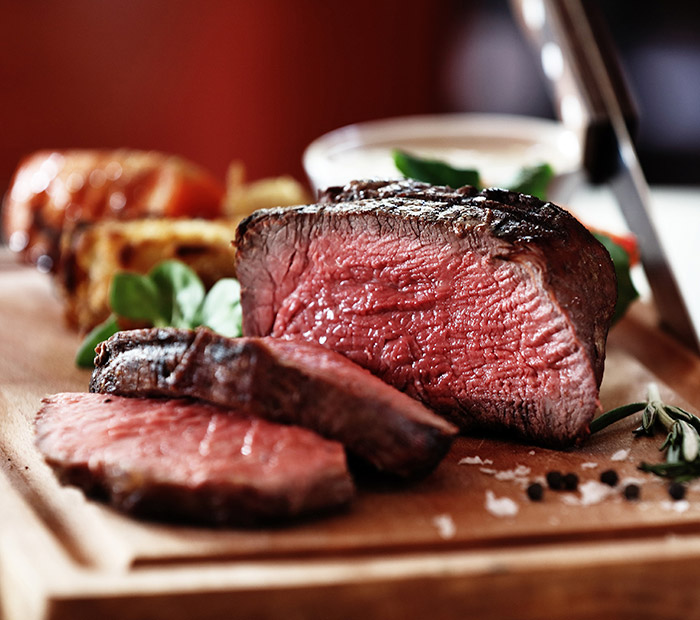
I want to click on cutting board, so click(x=512, y=585).